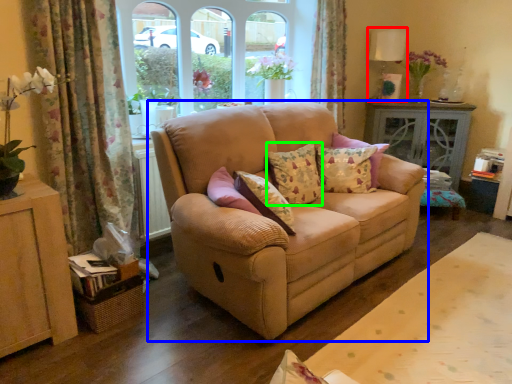
Question: Which object is positioned closest to lamp (highlighted by a red box)? Select from studio couch (highlighted by a blue box) and pillow (highlighted by a green box).

Choices:
 (A) studio couch
 (B) pillow

Answer: (B)